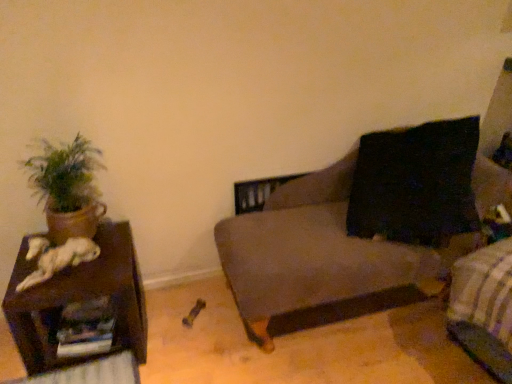
Find the location of a particular element. The image size is (512, 384). unoccupied region to the right of brown wooden side table at left is located at coordinates (187, 330).